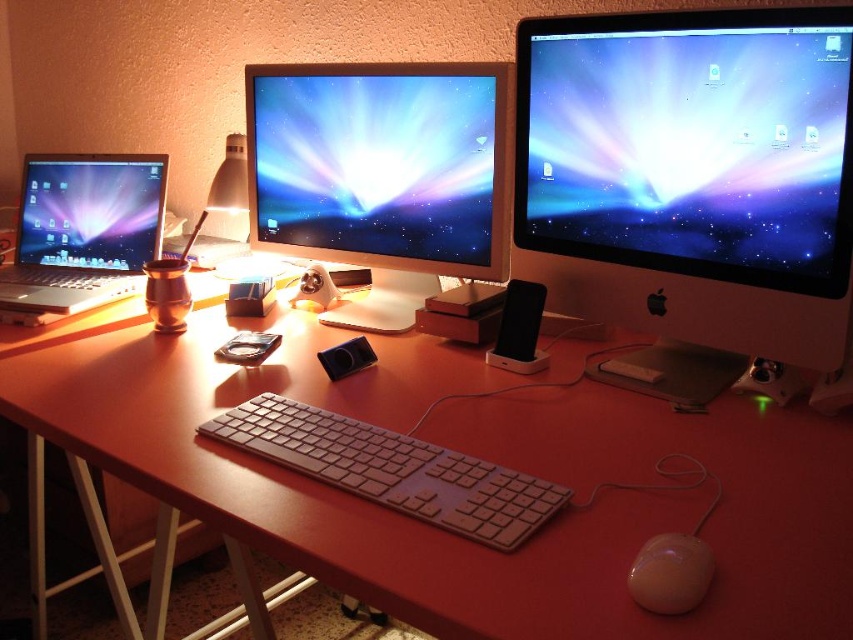
Question: Does satin silver monitor at upper right appear under white plastic keyboard at center?

Choices:
 (A) no
 (B) yes

Answer: (A)

Question: Which point is closer to the camera taking this photo?

Choices:
 (A) (370, 467)
 (B) (811, 131)

Answer: (A)

Question: Which of the following is the farthest from the observer?

Choices:
 (A) matte black laptop at left
 (B) glossy plastic monitor at center
 (C) beige rubber mouse at lower right

Answer: (A)

Question: Can you confirm if white plastic keyboard at center is bigger than matte black laptop at left?

Choices:
 (A) no
 (B) yes

Answer: (A)

Question: Which point is farther to the camera?

Choices:
 (A) (123, 180)
 (B) (440, 490)
 (C) (666, 120)

Answer: (A)

Question: Is glossy plastic monitor at center behind beige rubber mouse at lower right?

Choices:
 (A) no
 (B) yes

Answer: (B)